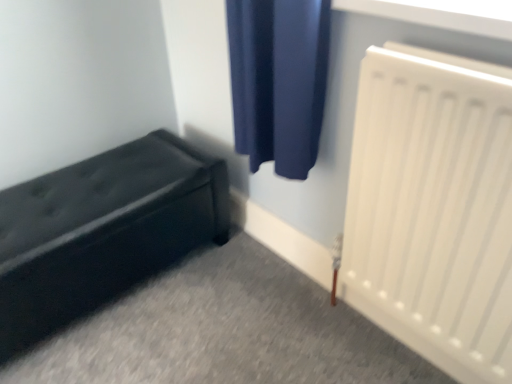
Question: Is black leather bench at lower left bigger or smaller than white plastic radiator at right?

Choices:
 (A) big
 (B) small

Answer: (A)

Question: In terms of height, does black leather bench at lower left look taller or shorter compared to white plastic radiator at right?

Choices:
 (A) short
 (B) tall

Answer: (A)

Question: From a real-world perspective, is black leather bench at lower left above or below white plastic radiator at right?

Choices:
 (A) below
 (B) above

Answer: (A)

Question: Considering the positions of white plastic radiator at right and black leather bench at lower left in the image, is white plastic radiator at right wider or thinner than black leather bench at lower left?

Choices:
 (A) wide
 (B) thin

Answer: (B)

Question: Based on their sizes in the image, would you say white plastic radiator at right is bigger or smaller than black leather bench at lower left?

Choices:
 (A) big
 (B) small

Answer: (B)

Question: From a real-world perspective, relative to black leather bench at lower left, is white plastic radiator at right vertically above or below?

Choices:
 (A) above
 (B) below

Answer: (A)

Question: Is point (368, 301) positioned closer to the camera than point (138, 271)?

Choices:
 (A) closer
 (B) farther

Answer: (A)